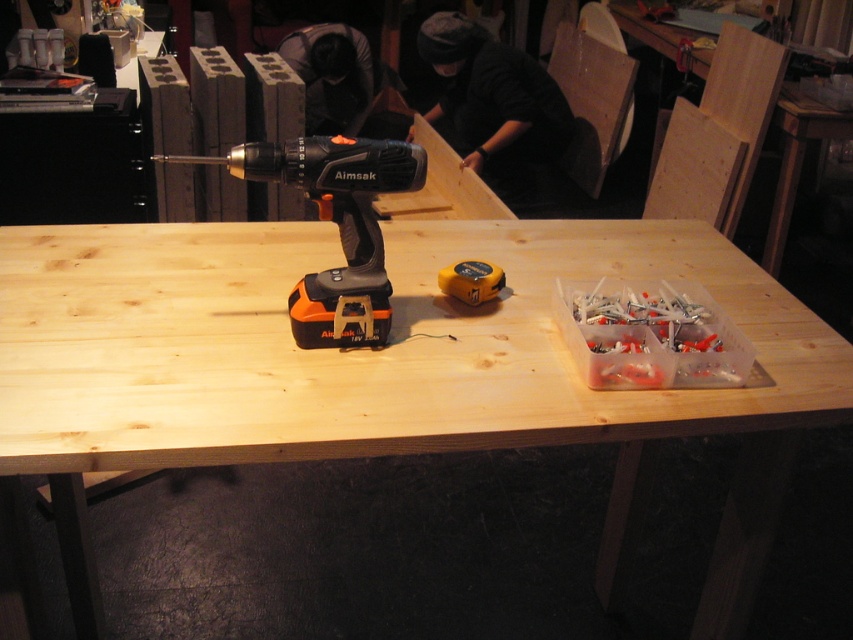
Question: Which object is farther from the camera taking this photo?

Choices:
 (A) black plastic drill at center
 (B) light wood table at center

Answer: (A)

Question: Can you confirm if black plastic drill at center is wider than black fabric person at upper center?

Choices:
 (A) no
 (B) yes

Answer: (A)

Question: Which is nearer to the light wood table at center?

Choices:
 (A) black fabric person at upper center
 (B) yellow rubber tape measure at center
 (C) black plastic drill at center

Answer: (C)

Question: Is light wood table at center bigger than yellow rubber tape measure at center?

Choices:
 (A) yes
 (B) no

Answer: (A)

Question: Does black fabric at upper center appear over black fabric person at upper center?

Choices:
 (A) no
 (B) yes

Answer: (A)

Question: Which point appears closest to the camera in this image?

Choices:
 (A) (439, 72)
 (B) (318, 29)
 (C) (386, 316)
 (D) (473, 285)

Answer: (C)